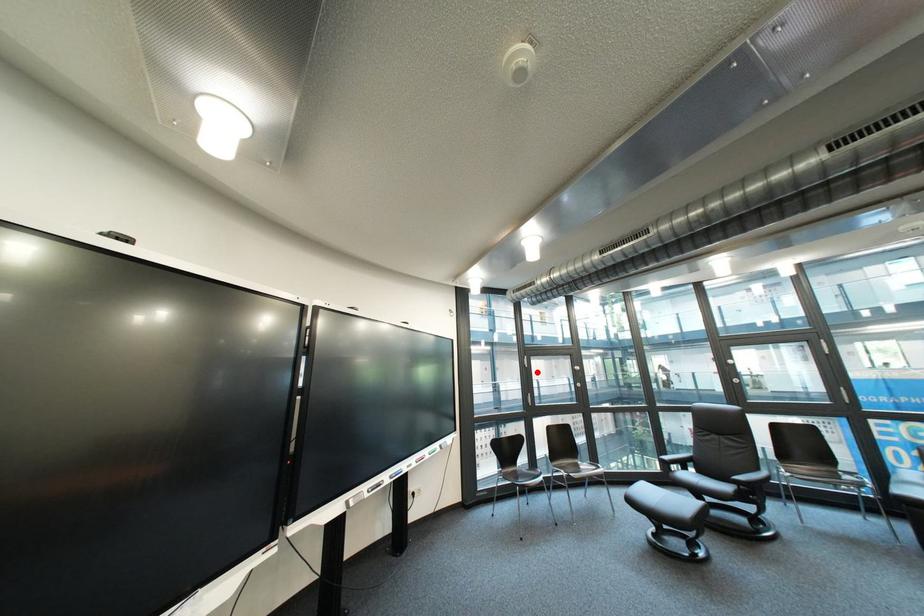
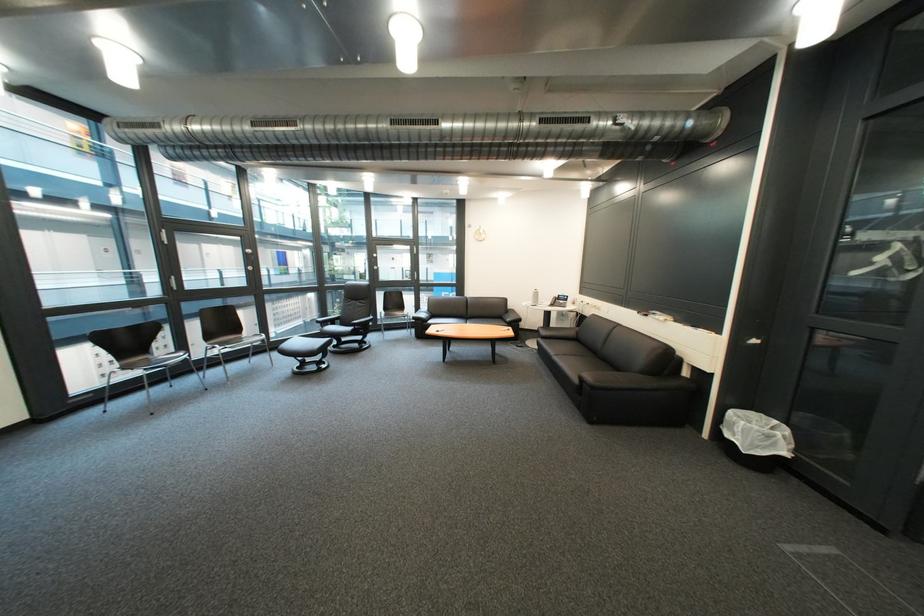
The point at the highlighted location is marked in the first image. Where is the corresponding point in the second image?

(176, 249)